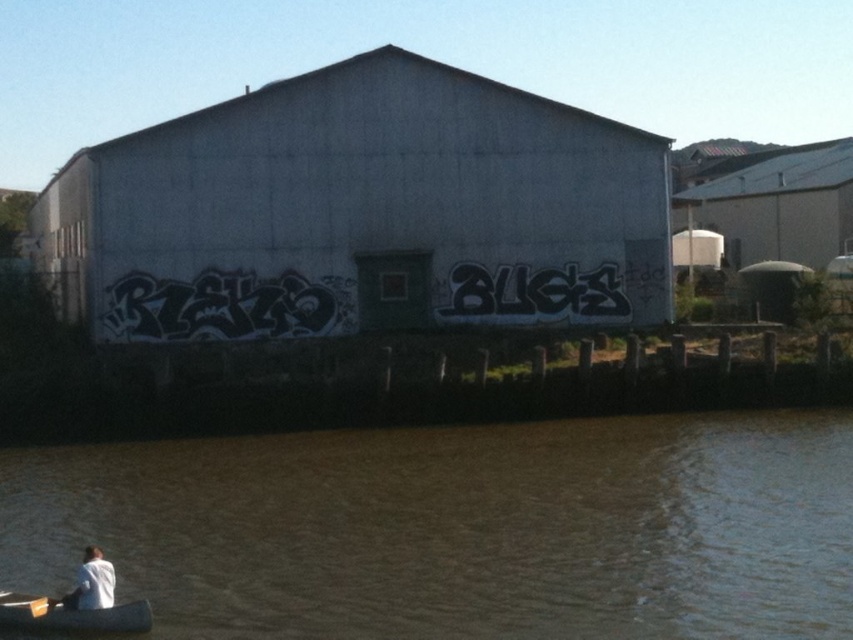
Does wooden canoe at lower left have a greater height compared to white matte shirt at lower left?

No.

What do you see at coordinates (71, 616) in the screenshot? This screenshot has height=640, width=853. I see `wooden canoe at lower left` at bounding box center [71, 616].

Find the location of `wooden canoe at lower left`. wooden canoe at lower left is located at coordinates (71, 616).

Does brown murky water at lower left have a lesser width compared to white matte shirt at lower left?

In fact, brown murky water at lower left might be wider than white matte shirt at lower left.

Which of these two, brown murky water at lower left or white matte shirt at lower left, stands shorter?

With less height is white matte shirt at lower left.

Does point (311, 602) lie in front of point (78, 609)?

No, it is behind (78, 609).

Locate an element on the screen. brown murky water at lower left is located at coordinates (459, 529).

Is brown murky water at lower left taller than wooden canoe at lower left?

Yes, brown murky water at lower left is taller than wooden canoe at lower left.

Is point (44, 582) farther from viewer compared to point (149, 627)?

That is True.

Identify the location of brown murky water at lower left. The width and height of the screenshot is (853, 640). (459, 529).